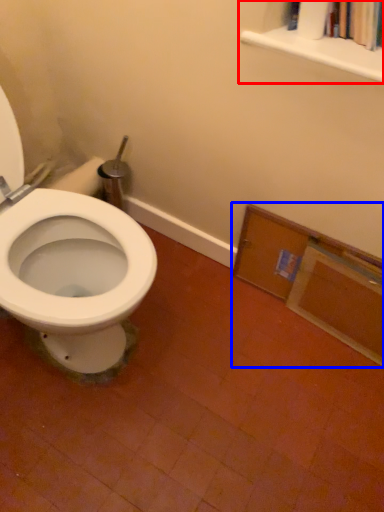
Question: Which object is closer to the camera taking this photo, bookcase (highlighted by a red box) or medicine cabinet (highlighted by a blue box)?

Choices:
 (A) bookcase
 (B) medicine cabinet

Answer: (A)